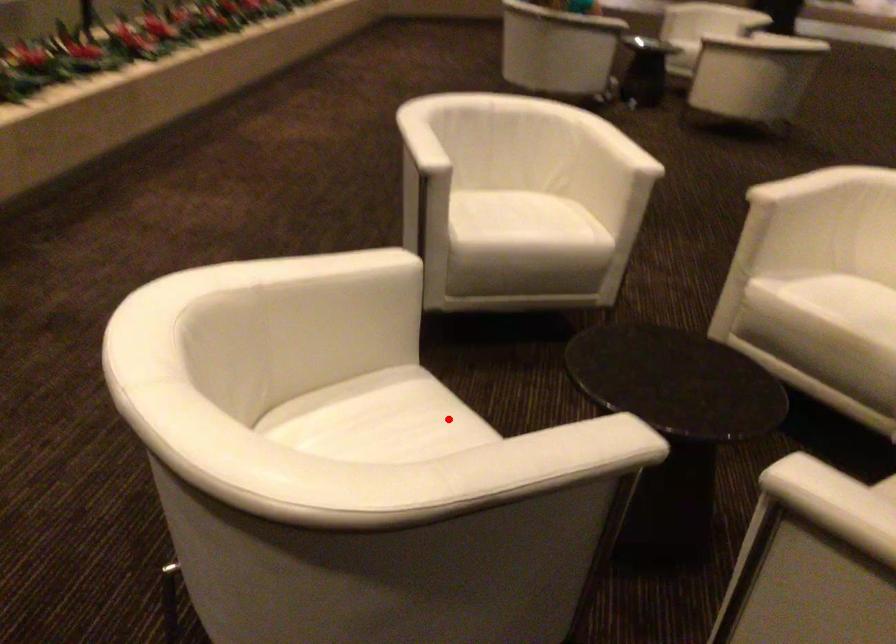
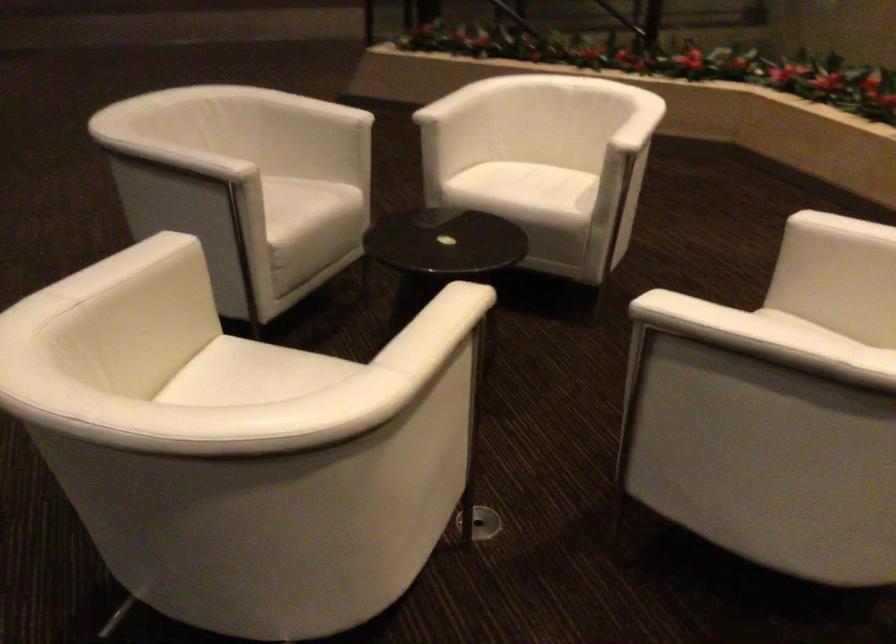
The point at the highlighted location is marked in the first image. Where is the corresponding point in the second image?

(528, 194)